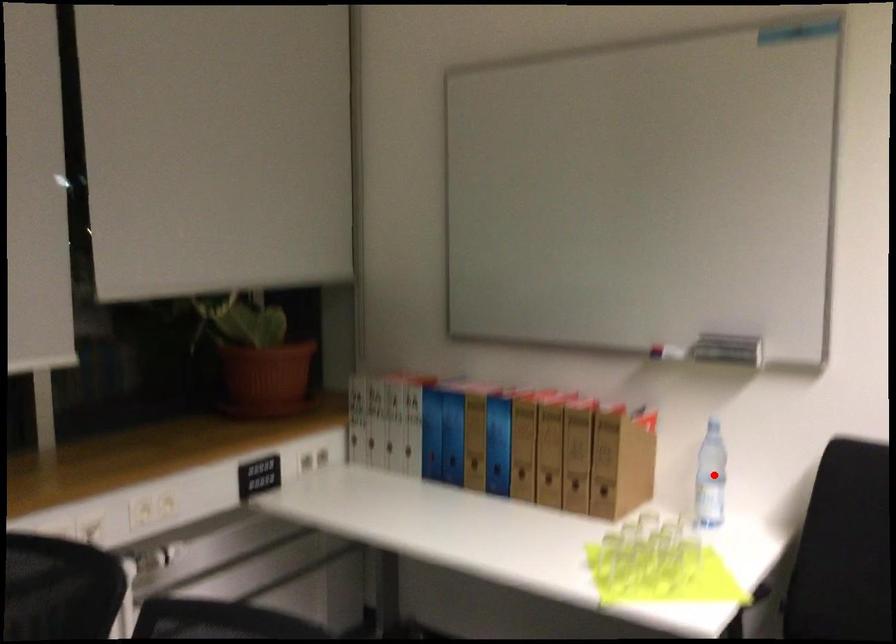
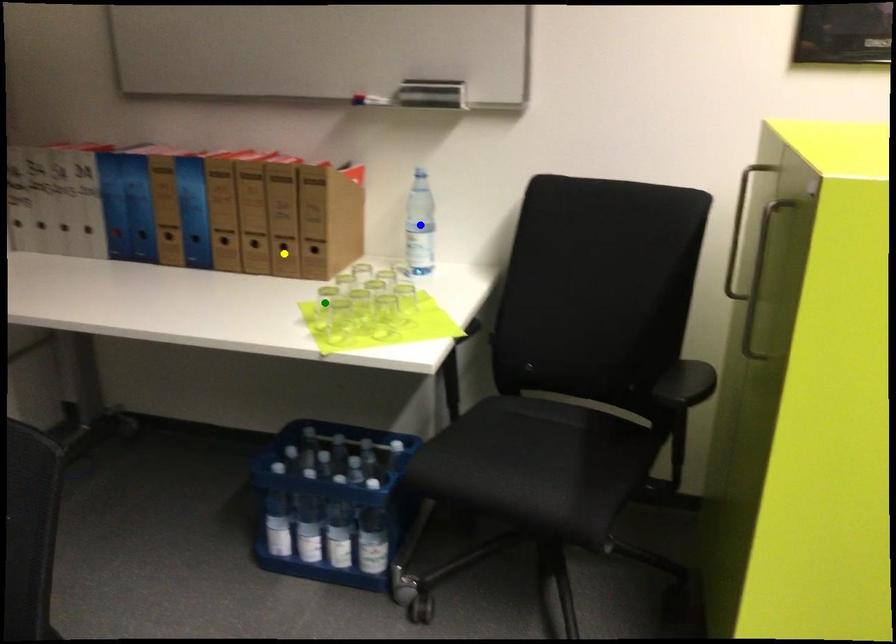
Question: I am providing you with two images of the same scene from different viewpoints. A red point is marked on the first image. You are given multiple points on the second image. Which mark in image 2 goes with the point in image 1?

Choices:
 (A) blue point
 (B) green point
 (C) yellow point

Answer: (A)